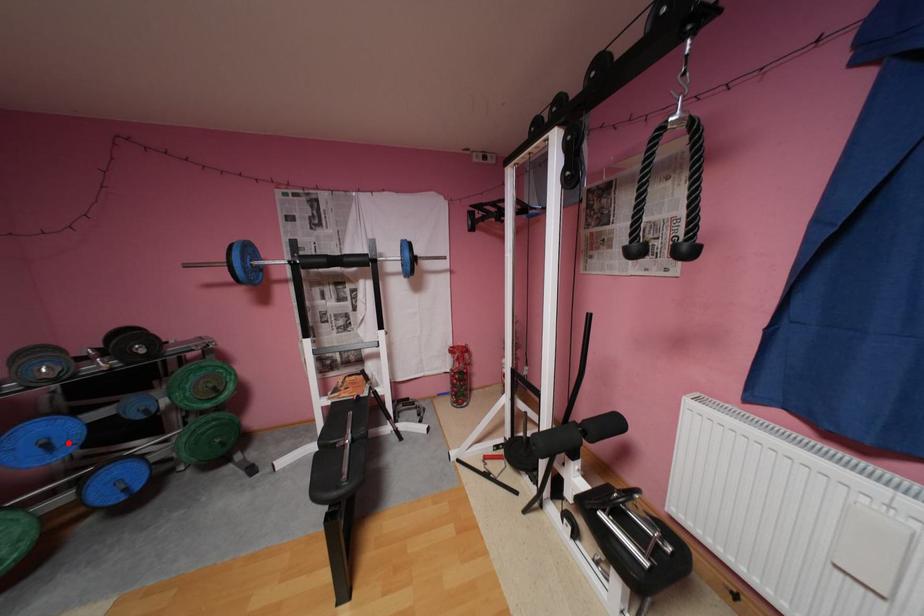
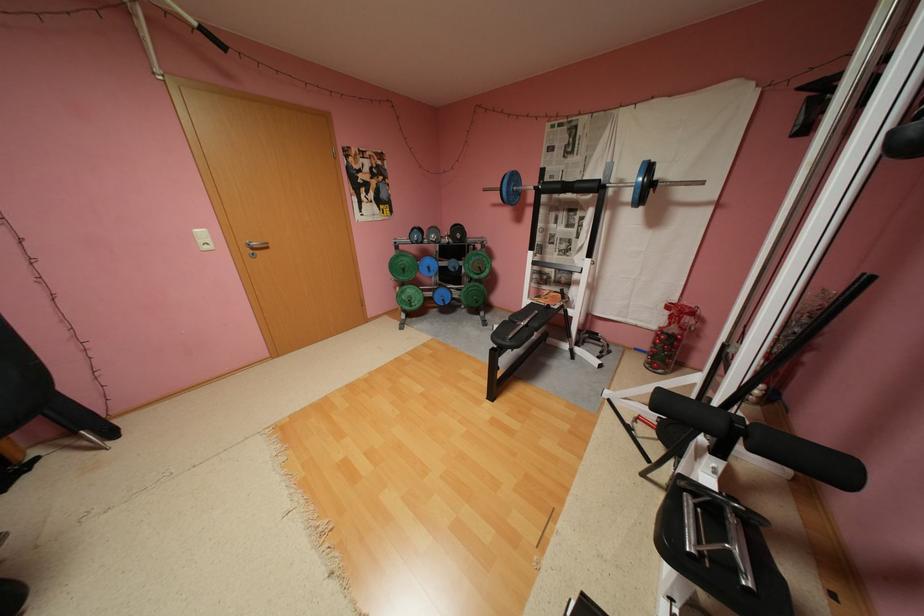
The point at the highlighted location is marked in the first image. Where is the corresponding point in the second image?

(441, 269)